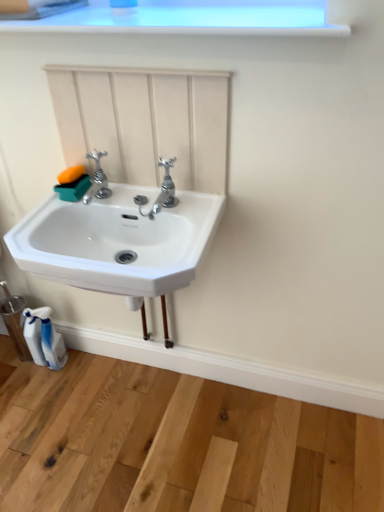
Where is `vacant area that lies to the right of polished chrome tap at center, placed as the 2th tap when sorted from right to left`? vacant area that lies to the right of polished chrome tap at center, placed as the 2th tap when sorted from right to left is located at coordinates pyautogui.click(x=144, y=201).